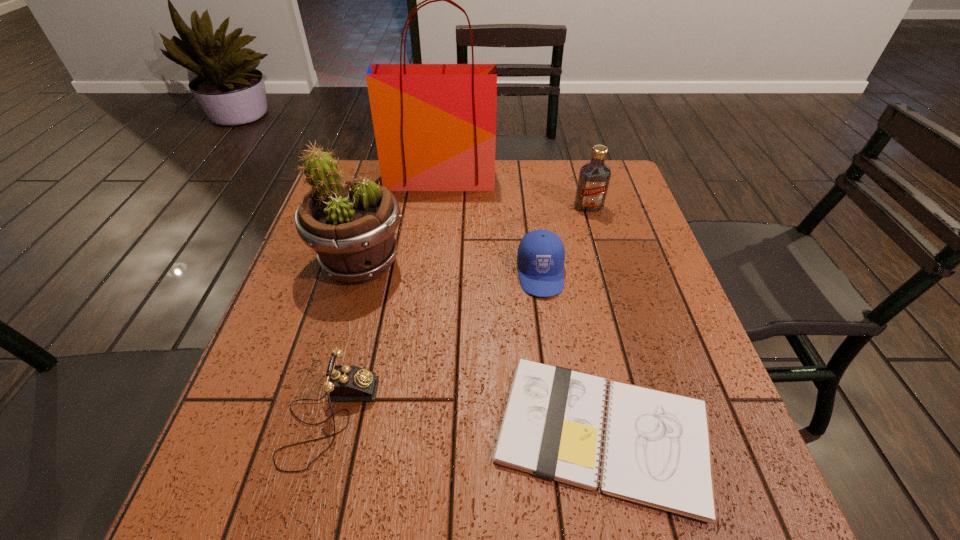
The image size is (960, 540). Find the location of `the farthest object`. the farthest object is located at coordinates (435, 124).

Where is `the tallest object`? the tallest object is located at coordinates (435, 124).

Identify the location of flowerpot. (350, 224).

Locate an element on the screen. The image size is (960, 540). the third tallest object is located at coordinates (594, 177).

You are a GUI agent. You are given a task and a screenshot of the screen. Output one action in this format:
    pyautogui.click(x=<x>, y=<y>)
    Task: Click on the second farthest object
    The width and height of the screenshot is (960, 540).
    Given the screenshot: What is the action you would take?
    pyautogui.click(x=594, y=177)

Identify the location of cap. The height and width of the screenshot is (540, 960). [540, 258].

At what (x,y) coordinates should I click in order to perform the action: click on telephone. Please return your answer as a coordinate pair (x, y). The width and height of the screenshot is (960, 540). Looking at the image, I should click on (344, 382).

This screenshot has height=540, width=960. I want to click on the shortest object, so click(x=656, y=452).

Locate an element on the screen. Image resolution: width=960 pixels, height=540 pixels. free space located on the handle side of the tallest object is located at coordinates (436, 221).

You are a GUI agent. You are given a task and a screenshot of the screen. Output one action in this format:
    pyautogui.click(x=<x>, y=<y>)
    Task: Click on the blank area located 0.100m on the right of the flowerpot
    
    Given the screenshot: What is the action you would take?
    pyautogui.click(x=449, y=263)